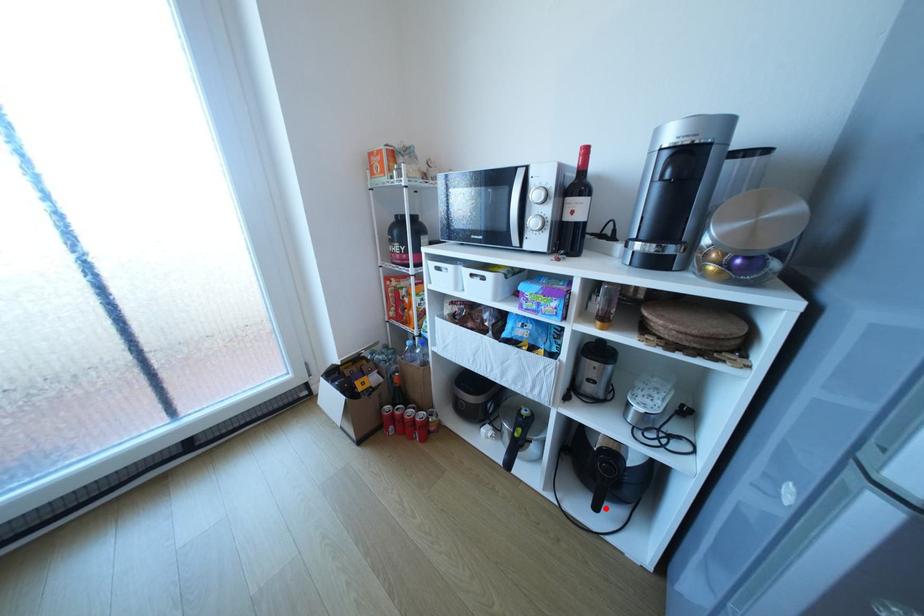
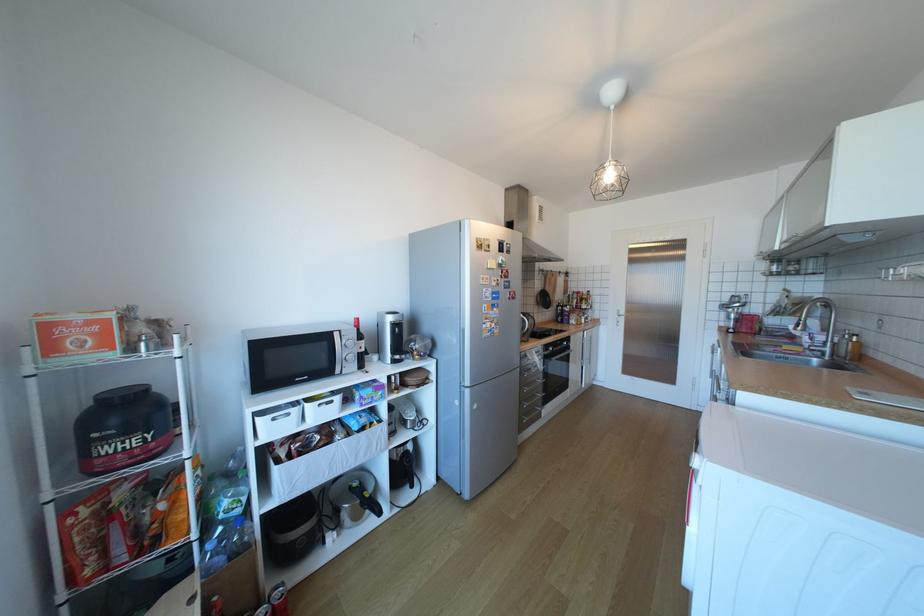
The point at the highlighted location is marked in the first image. Where is the corresponding point in the second image?

(420, 485)